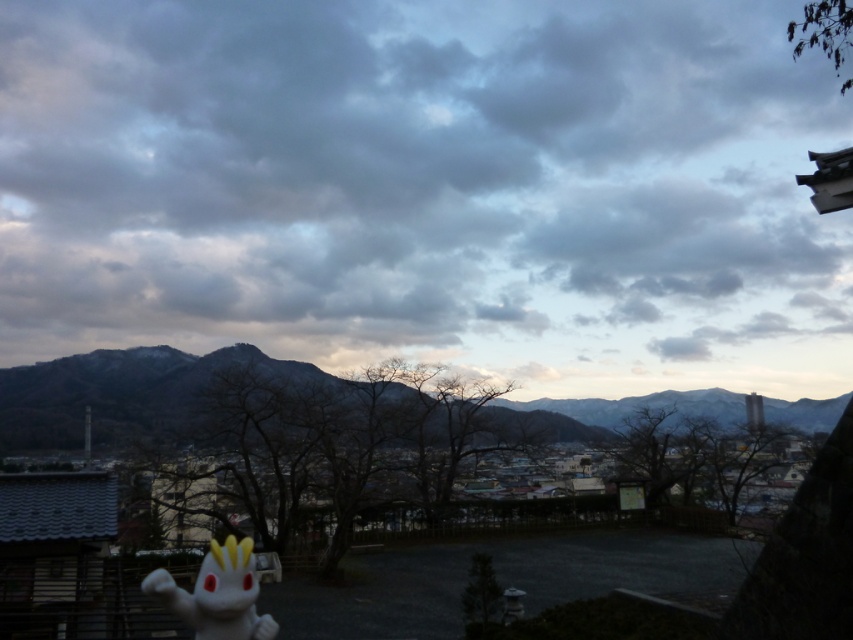
Who is lower down, matte gray dusk at center or rocky brown mountain at center?

rocky brown mountain at center

Is matte gray dusk at center smaller than rocky brown mountain at center?

Actually, matte gray dusk at center might be larger than rocky brown mountain at center.

I want to click on matte gray dusk at center, so click(427, 189).